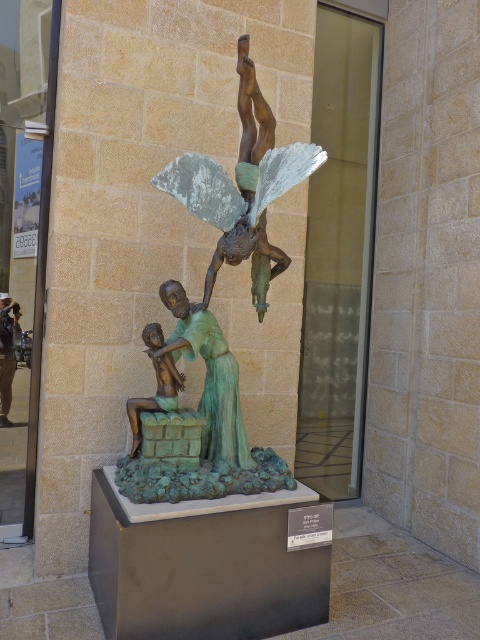
Question: Which point appears closest to the camera in this image?

Choices:
 (A) (x=262, y=256)
 (B) (x=205, y=408)

Answer: (B)

Question: Does bronze figure at center have a greater width compared to bronze statue at center?

Choices:
 (A) yes
 (B) no

Answer: (A)

Question: In this image, where is green patina bronze sculpture at center located relative to bronze figure at center?

Choices:
 (A) below
 (B) above

Answer: (B)

Question: Which point is closer to the camera?

Choices:
 (A) (164, 397)
 (B) (2, 397)

Answer: (A)

Question: Which point is closer to the camera taking this photo?

Choices:
 (A) (212, 394)
 (B) (182, 196)
 (C) (164, 397)
 (D) (7, 333)

Answer: (B)

Question: Is green patina statue at center to the right of bronze statue at center from the viewer's perspective?

Choices:
 (A) no
 (B) yes

Answer: (B)